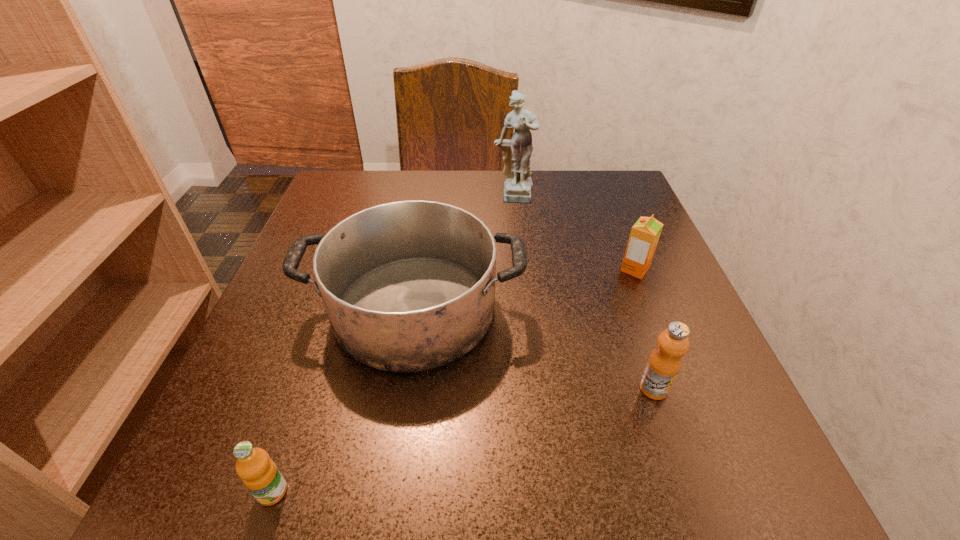
The width and height of the screenshot is (960, 540). What are the coordinates of `free region at the far right corner` in the screenshot? It's located at (617, 192).

Identify the location of vacant space at the near right corner of the desktop. The width and height of the screenshot is (960, 540). click(646, 470).

Locate an element on the screen. unoccupied position between the farthest orange juice and the saucepan is located at coordinates (525, 289).

In order to click on vacant region between the second nearest orange juice and the saucepan in this screenshot , I will do `click(534, 349)`.

This screenshot has height=540, width=960. What are the coordinates of `vacant area that lies between the farthest orange juice and the saucepan` in the screenshot? It's located at (525, 289).

I want to click on free space that is in between the saucepan and the farthest orange juice, so click(525, 289).

The height and width of the screenshot is (540, 960). Find the location of `free space between the nearest orange juice and the saucepan`. free space between the nearest orange juice and the saucepan is located at coordinates (344, 400).

The width and height of the screenshot is (960, 540). I want to click on vacant space in between the saucepan and the fourth farthest object, so click(x=534, y=349).

I want to click on vacant area that lies between the farthest orange juice and the nearest object, so click(454, 381).

The height and width of the screenshot is (540, 960). Identify the location of vacant space in between the fourth farthest object and the farthest orange juice. (644, 329).